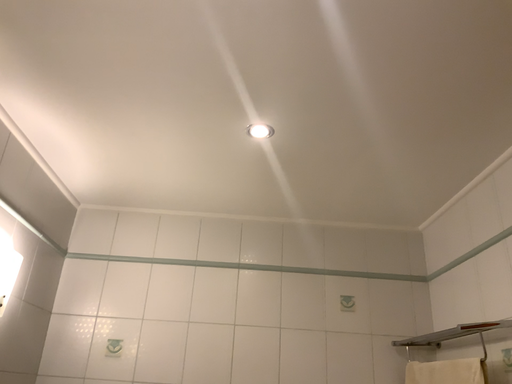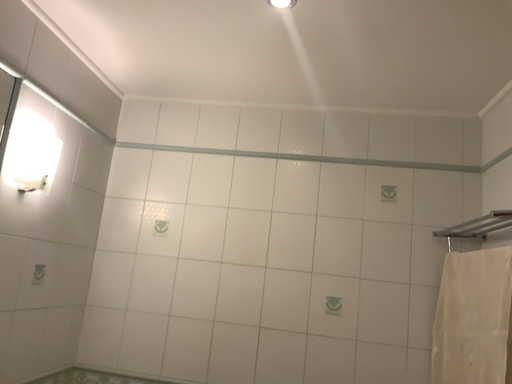
Question: How did the camera likely rotate when shooting the video?

Choices:
 (A) rotated downward
 (B) rotated upward

Answer: (A)